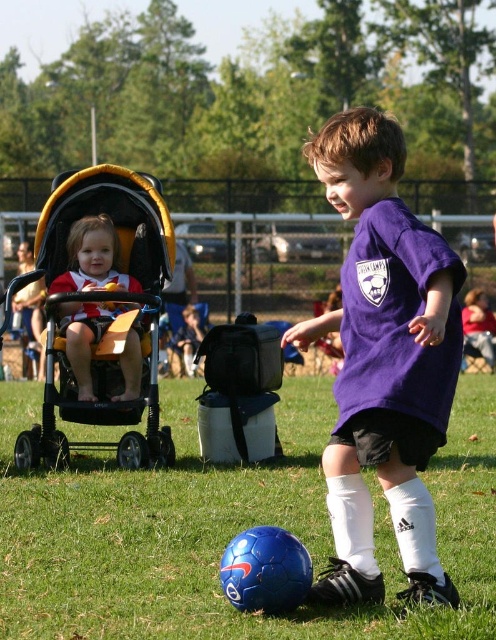
Question: Which point is closer to the camera?

Choices:
 (A) yellow fabric stroller at left
 (B) purple matte shirt at center
 (C) green grass at lower center
 (D) matte red and white shirt at left

Answer: (B)

Question: Is green grass at lower center wider than yellow fabric stroller at left?

Choices:
 (A) yes
 (B) no

Answer: (B)

Question: Is yellow fabric stroller at left further to the viewer compared to matte red and white shirt at left?

Choices:
 (A) no
 (B) yes

Answer: (A)

Question: Which point is farther to the camera?

Choices:
 (A) (105, 284)
 (B) (116, 250)
 (C) (406, 326)

Answer: (B)

Question: Which object appears closest to the camera in this image?

Choices:
 (A) yellow fabric stroller at left
 (B) purple matte shirt at center
 (C) matte red and white shirt at left
 (D) green grass at lower center

Answer: (B)

Question: Does yellow fabric stroller at left appear on the right side of matte red and white shirt at left?

Choices:
 (A) yes
 (B) no

Answer: (B)